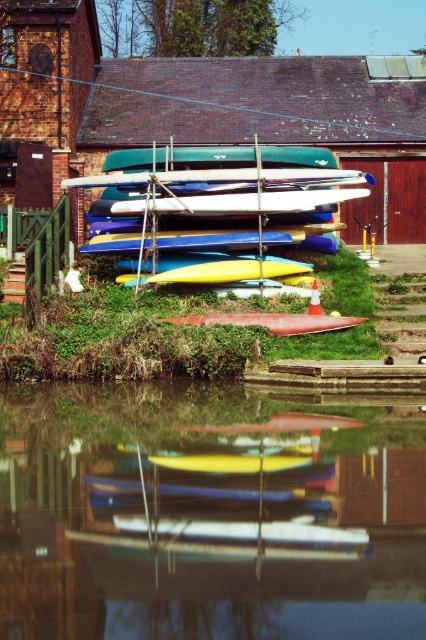
Describe the element at coordinates (207, 515) in the screenshot. This screenshot has width=426, height=640. I see `glossy water at lower center` at that location.

Consider the image. Between glossy water at lower center and yellow matte kayak at center, which one appears on the right side from the viewer's perspective?

From the viewer's perspective, yellow matte kayak at center appears more on the right side.

Does point (71, 438) come in front of point (305, 237)?

That is True.

Identify the location of glossy water at lower center. (207, 515).

Can you confirm if yellow matte kayak at center is smaller than smooth red canoe at center?

No, yellow matte kayak at center is not smaller than smooth red canoe at center.

Does point (322, 193) come behind point (345, 317)?

Yes, point (322, 193) is behind point (345, 317).

You are a GUI agent. You are given a task and a screenshot of the screen. Output one action in this format:
    pyautogui.click(x=<x>, y=<y>)
    Task: Click on the yellow matte kayak at center
    
    Given the screenshot: What is the action you would take?
    pyautogui.click(x=213, y=204)

Does glossy water at lower center have a smaller size compared to smooth red canoe at center?

Yes.

Who is more forward, [393,604] or [291,330]?

Point [393,604] is more forward.

Is point (134, 595) positioned after point (256, 321)?

No, it is in front of (256, 321).

This screenshot has height=640, width=426. I want to click on glossy water at lower center, so click(x=207, y=515).